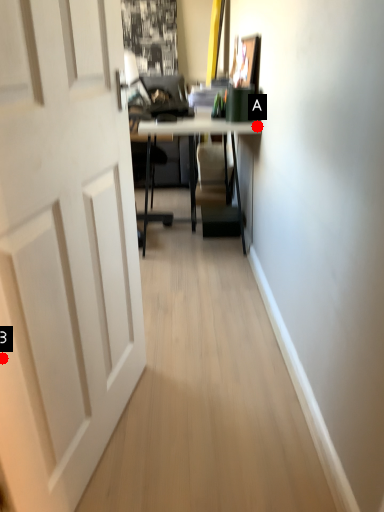
Question: Two points are circled on the image, labeled by A and B beside each circle. Which point is farther to the camera?

Choices:
 (A) A is further
 (B) B is further

Answer: (A)